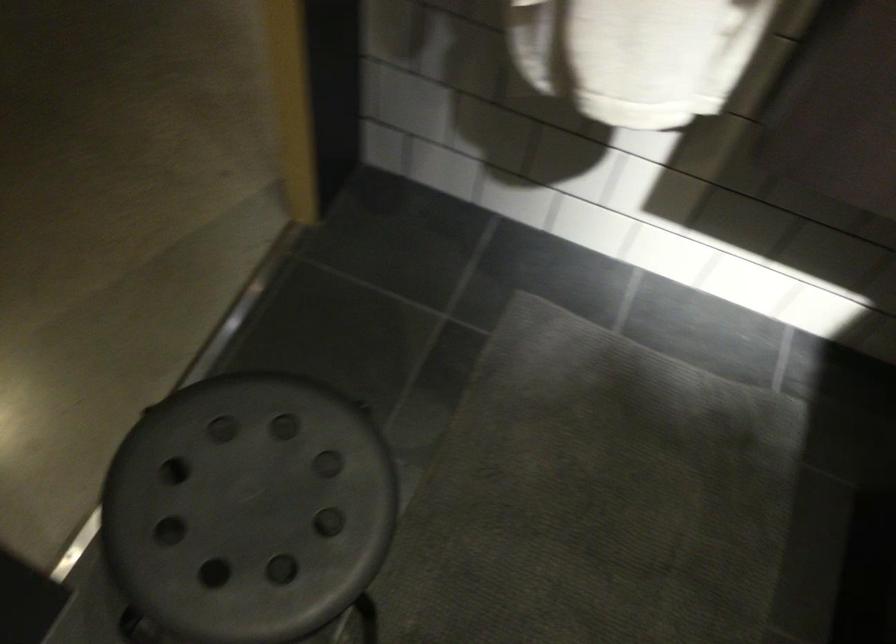
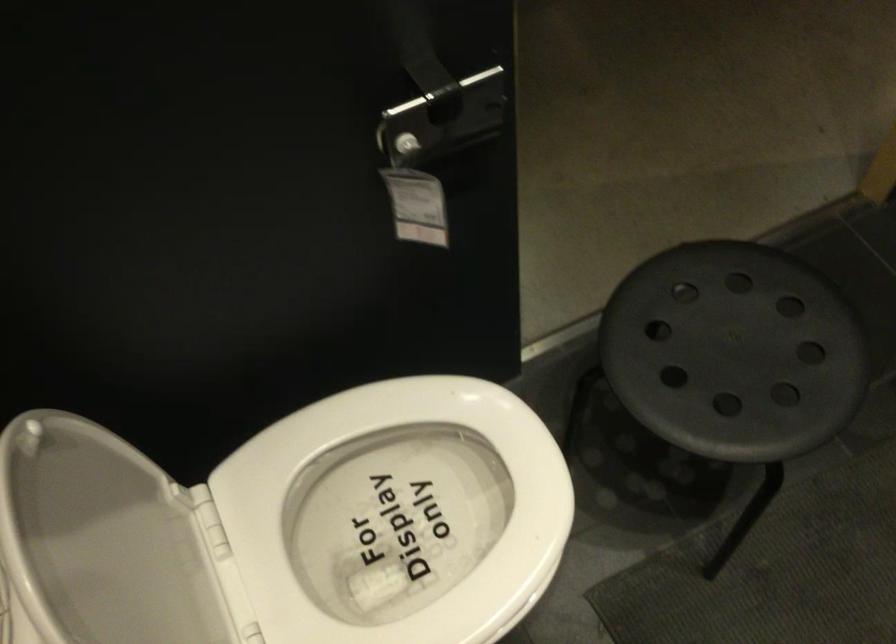
Question: How did the camera likely rotate?

Choices:
 (A) Left
 (B) Right
 (C) Up
 (D) Down

Answer: (A)